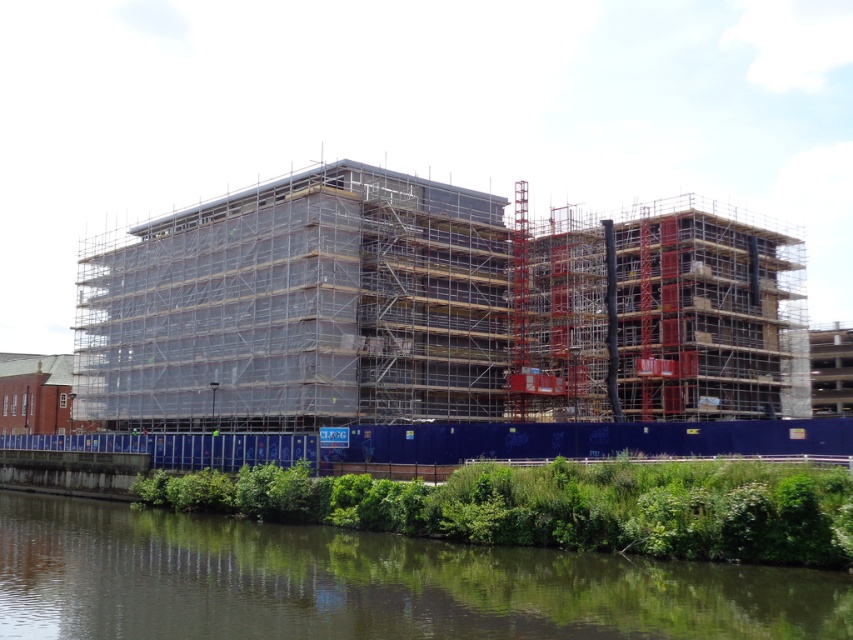
You are a construction inspector standing at the site. You need to inspect the clear plastic scaffolding at center. Given that your inspection equipment has a maximum reach of 70 meters, can you effectively inspect it from your current position?

The clear plastic scaffolding at center is 73.72 meters from viewer. Since the equipment has a maximum reach of 70 meters, it is beyond the effective range. You cannot inspect it from your current position.

You are a construction worker standing outside the blue temporary fence. You need to determine the relative positions of the clear plastic scaffolding at center and the green leafy vegetation at lower center. Which object is positioned higher from the ground?

The clear plastic scaffolding at center is located above the green leafy vegetation at lower center, so it is positioned higher from the ground.